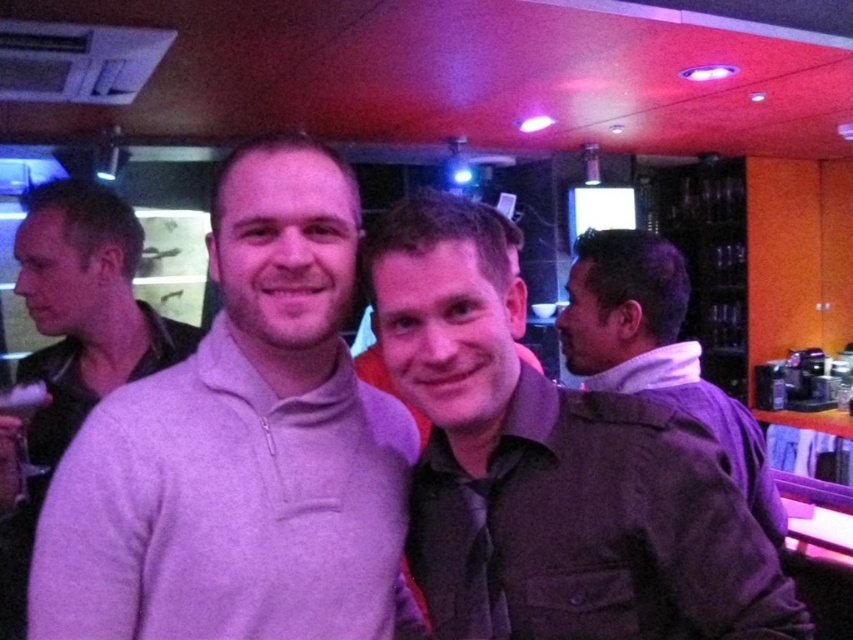
Consider the image. You are standing at the entrance of the bar and see the point at coordinates [242,448]. What object is located at that point?

The point at coordinates [242,448] corresponds to the gray fleece sweater at center.

You are a photographer setting up a shoot in this bar. You need to place a narrow accessory between the matte gray shirt at center and the light purple sweater at center. Which side should you place it on to ensure it fits without overlapping?

The matte gray shirt at center is thinner than the light purple sweater at center, so placing the narrow accessory between them should be on the side of the matte gray shirt at center to ensure it fits without overlapping.

You are a photographer adjusting your camera settings to focus on the two people in the image. The gray fleece sweater at center and the matte gray shirt at center are both in the frame. Which one is positioned higher in the image?

The gray fleece sweater at center is positioned higher than the matte gray shirt at center in the image.